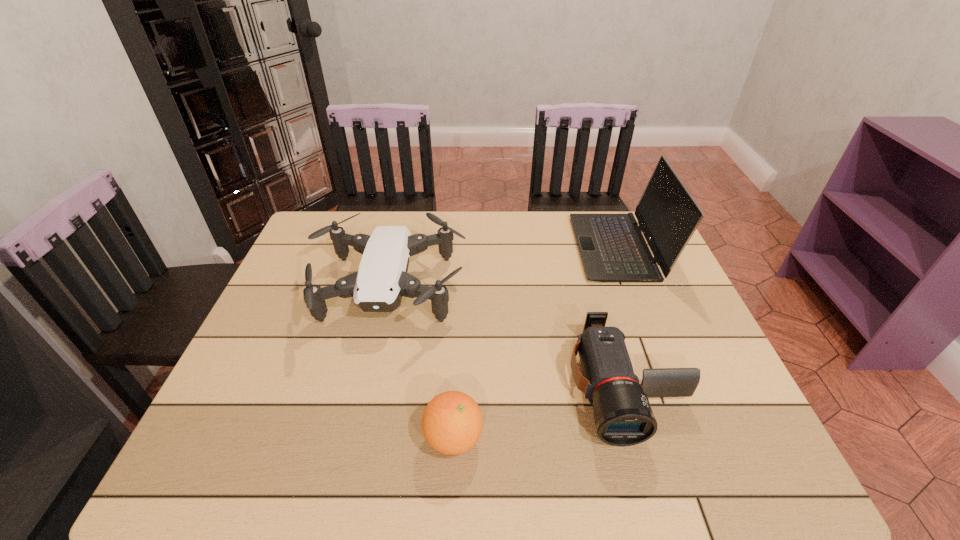
Locate an element on the screen. This screenshot has width=960, height=540. laptop computer is located at coordinates (612, 247).

Identify the location of drone. (378, 286).

The width and height of the screenshot is (960, 540). Identify the location of camcorder. (623, 414).

This screenshot has width=960, height=540. What are the coordinates of `orange` in the screenshot? It's located at click(x=452, y=422).

Identify the location of vacant area located 0.290m on the screen of the tallest object. This screenshot has height=540, width=960. (484, 248).

Identify the location of free space located 0.180m on the screen of the tallest object. This screenshot has width=960, height=540. (519, 248).

What are the coordinates of `free spot located on the screen of the tallest object` in the screenshot? It's located at (516, 248).

Where is `free spot located 0.270m on the camera side of the second tallest object`? Image resolution: width=960 pixels, height=540 pixels. free spot located 0.270m on the camera side of the second tallest object is located at coordinates (351, 451).

Where is `vacant space situated on the lens of the camcorder`? Image resolution: width=960 pixels, height=540 pixels. vacant space situated on the lens of the camcorder is located at coordinates (651, 472).

Locate an element on the screen. This screenshot has height=540, width=960. vacant region located 0.390m on the back of the orange is located at coordinates (461, 288).